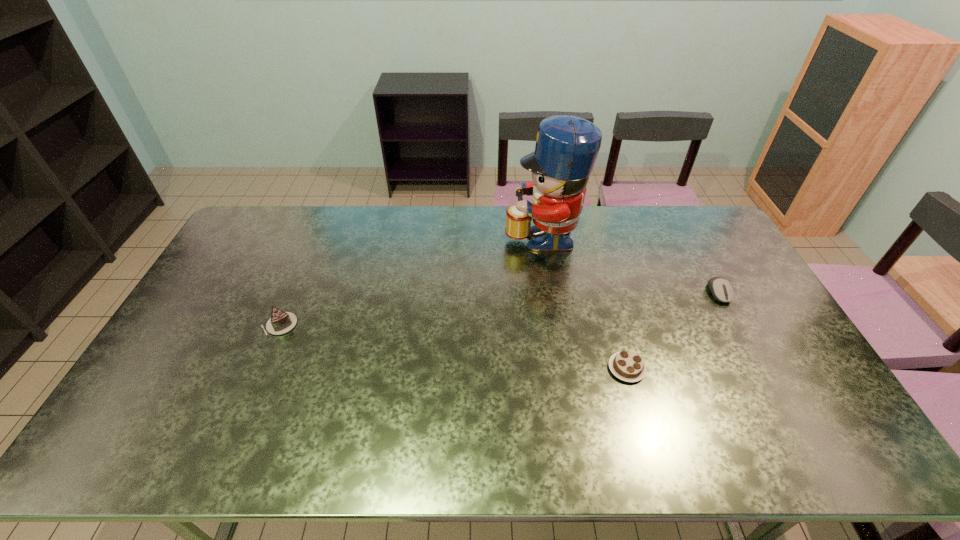
Identify the location of nutcracker. This screenshot has height=540, width=960. (567, 146).

Locate an element on the screen. The height and width of the screenshot is (540, 960). the tallest object is located at coordinates (567, 146).

At what (x,y) coordinates should I click in order to perform the action: click on the left chocolate cake. Please return your answer as a coordinate pair (x, y). Image resolution: width=960 pixels, height=540 pixels. Looking at the image, I should click on (281, 322).

Identify the location of the farther chocolate cake. (281, 322).

Where is `the third tallest object`? The image size is (960, 540). the third tallest object is located at coordinates (721, 289).

Locate an element on the screen. Image resolution: width=960 pixels, height=540 pixels. computer equipment is located at coordinates (721, 289).

Image resolution: width=960 pixels, height=540 pixels. Find the location of `the nearer chocolate cake`. the nearer chocolate cake is located at coordinates (627, 366).

This screenshot has height=540, width=960. What are the coordinates of `the shorter chocolate cake` in the screenshot? It's located at (627, 366).

What are the coordinates of `vacant space positioned 0.290m on the front-facing side of the nutcracker` in the screenshot? It's located at [x=426, y=235].

Where is `free space located on the front-facing side of the nutcracker`? This screenshot has width=960, height=540. free space located on the front-facing side of the nutcracker is located at coordinates (423, 235).